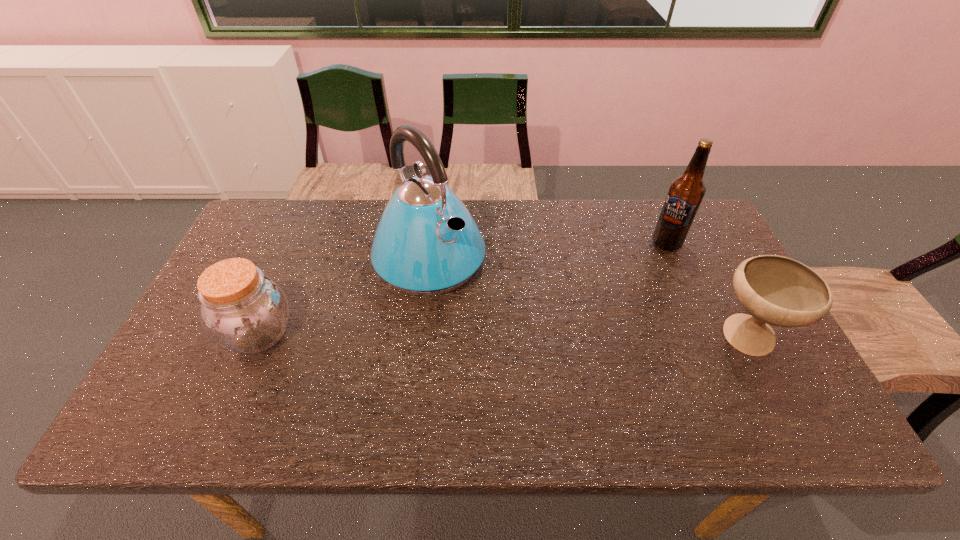
Where is `vacant space on the desktop that is between the jar and the chalice and is positioned at the spout of the tallest object`? Image resolution: width=960 pixels, height=540 pixels. vacant space on the desktop that is between the jar and the chalice and is positioned at the spout of the tallest object is located at coordinates (507, 336).

The height and width of the screenshot is (540, 960). I want to click on free space on the desktop that is between the jar and the chalice and is positioned on the label of the beer bottle, so click(x=528, y=336).